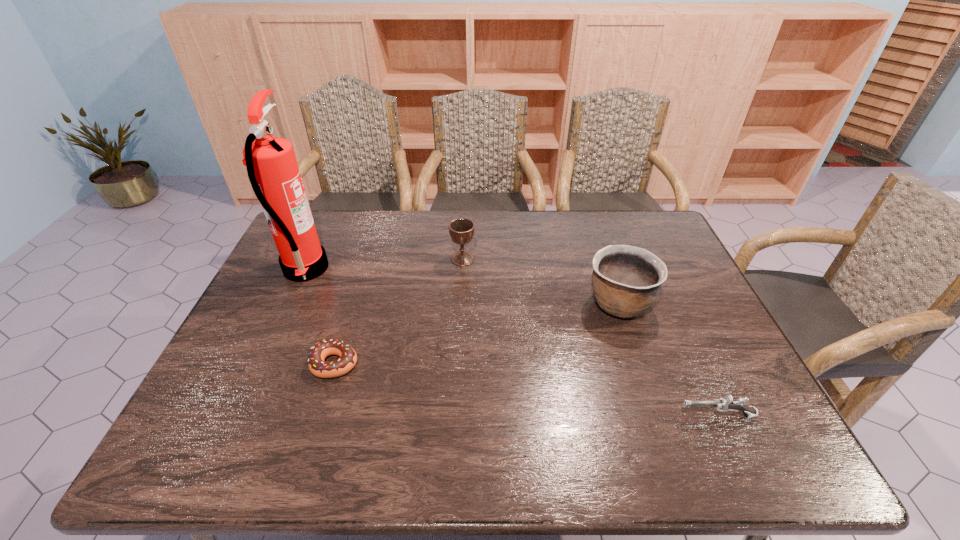
Where is `vacant region that satisfies the following two spatial constraints: 1. with the nozzle aimed from the fire extinguisher; 2. on the left side of the fourth farthest object`? vacant region that satisfies the following two spatial constraints: 1. with the nozzle aimed from the fire extinguisher; 2. on the left side of the fourth farthest object is located at coordinates (262, 363).

At what (x,y) coordinates should I click in order to perform the action: click on vacant space that satisfies the following two spatial constraints: 1. on the front side of the pottery; 2. on the left side of the third object from left to right. Please return your answer as a coordinate pair (x, y). This screenshot has width=960, height=540. Looking at the image, I should click on (461, 303).